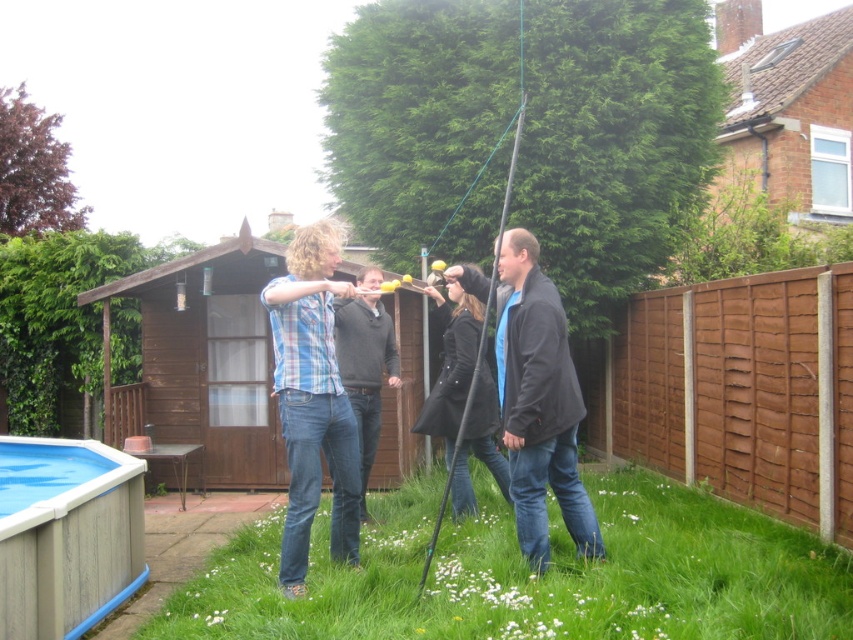
Between black leather jacket at center and blue plastic pool at lower left, which one has more height?

With more height is black leather jacket at center.

Is black leather jacket at center smaller than blue plastic pool at lower left?

No, black leather jacket at center is not smaller than blue plastic pool at lower left.

You are a GUI agent. You are given a task and a screenshot of the screen. Output one action in this format:
    pyautogui.click(x=<x>, y=<y>)
    Task: Click on the black leather jacket at center
    
    Given the screenshot: What is the action you would take?
    tap(463, 400)

Image resolution: width=853 pixels, height=640 pixels. Identify the location of black leather jacket at center. (463, 400).

Can you confirm if green grass at lower center is thinner than matte blue jeans at center?

No.

Where is `green grass at lower center`? green grass at lower center is located at coordinates (531, 577).

The image size is (853, 640). I want to click on green grass at lower center, so click(x=531, y=577).

Does brown wooden fence at right have a lesser height compared to black leather jacket at center?

Incorrect, brown wooden fence at right's height does not fall short of black leather jacket at center's.

Does brown wooden fence at right have a smaller size compared to black leather jacket at center?

Actually, brown wooden fence at right might be larger than black leather jacket at center.

Measure the distance between point (688, 324) and camera.

24.55 feet

Locate an element on the screen. The width and height of the screenshot is (853, 640). brown wooden fence at right is located at coordinates (735, 392).